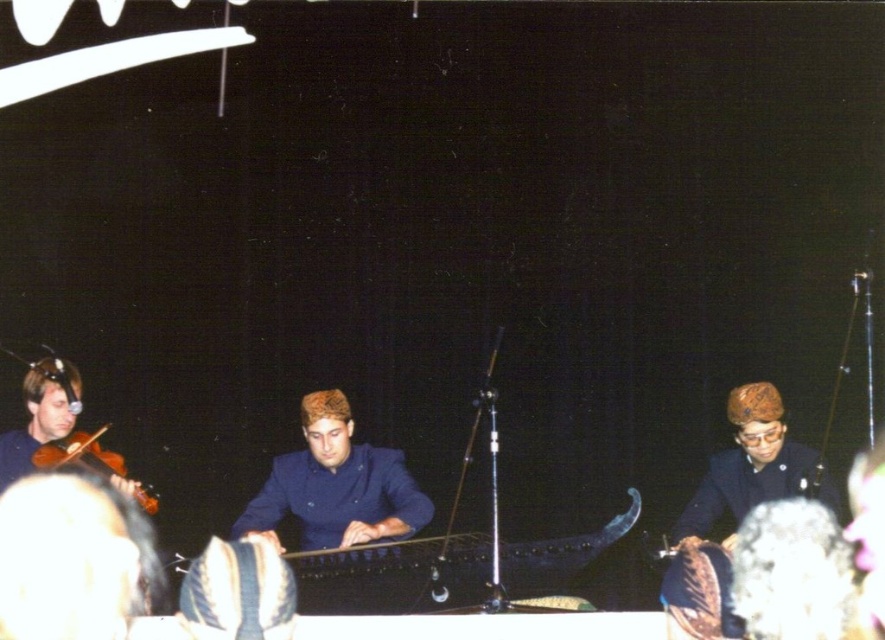
You are an audience member sitting in the front row of the stage. You notice the dark blue uniform at center and the matte brown violin at left. Which object is positioned lower from your viewpoint?

The dark blue uniform at center is positioned lower than the matte brown violin at left from your viewpoint.

You are a stagehand preparing to adjust the lighting for the performance. You notice two dark blue items at the center of the stage. Which one is closer to you, the dark blue fabric at center or the dark blue uniform at center?

The dark blue fabric at center is closer to you because it is in front of the dark blue uniform at center.